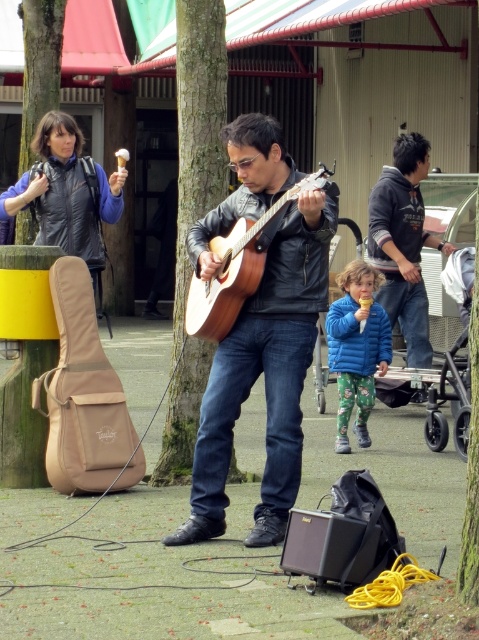
You are a photographer standing in the middle of the street. You want to take a photo of the dark gray hoodie at upper right and the green rough bark tree at upper left. Which object should you focus on first if you want to capture both in the same frame without moving the camera?

You should focus on the dark gray hoodie at upper right first because it is much taller than the green rough bark tree at upper left, so it will be easier to include both in the frame by centering on the taller object.